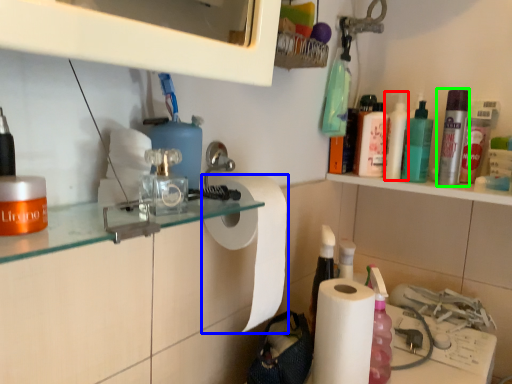
Question: Which object is positioned closest to cleaning product (highlighted by a red box)? Select from paper towel (highlighted by a blue box) and mouthwash (highlighted by a green box).

Choices:
 (A) paper towel
 (B) mouthwash

Answer: (B)